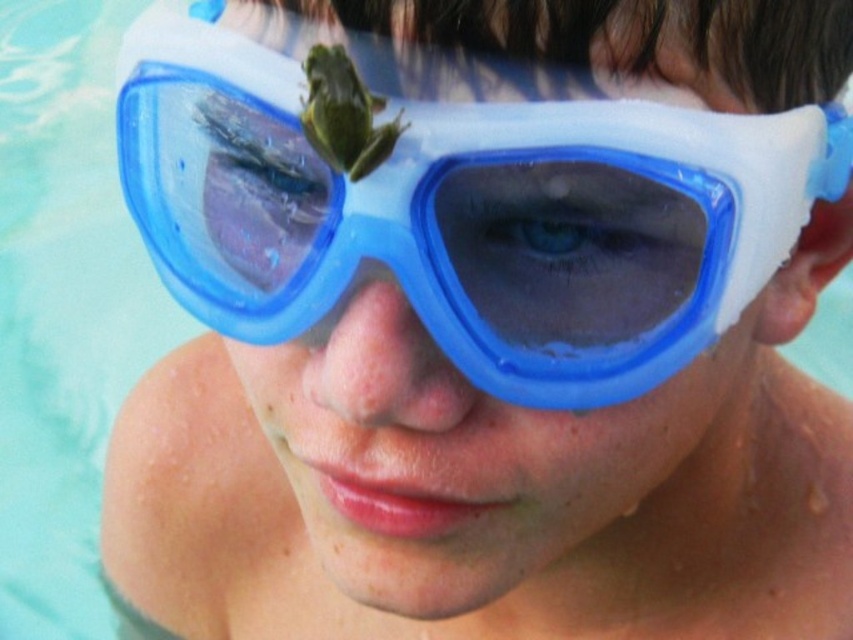
Question: Which point is closer to the camera?

Choices:
 (A) transparent plastic goggles at center
 (B) blue plastic goggles at center

Answer: (B)

Question: Is transparent plastic goggles at center further to camera compared to blue plastic goggles at center?

Choices:
 (A) no
 (B) yes

Answer: (B)

Question: Is the position of transparent plastic goggles at center more distant than that of blue plastic goggles at center?

Choices:
 (A) no
 (B) yes

Answer: (B)

Question: Is transparent plastic goggles at center closer to camera compared to blue plastic goggles at center?

Choices:
 (A) no
 (B) yes

Answer: (A)